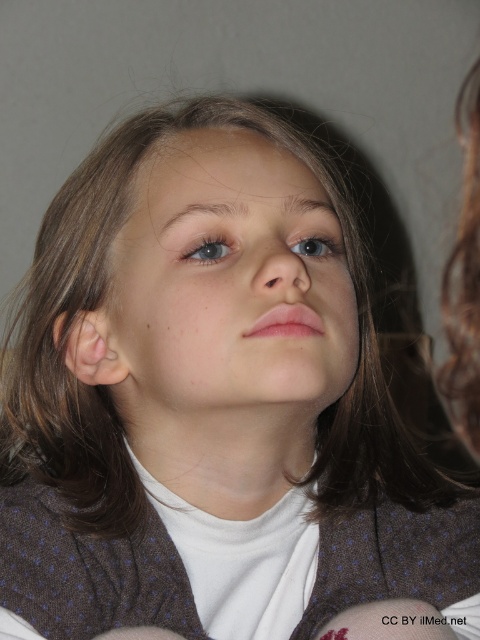
Does smooth skin face at center appear under blue glossy eye at upper center?

Yes.

Is smooth skin face at center further to camera compared to blue glossy eye at upper center?

No, it is not.

Locate an element on the screen. smooth skin face at center is located at coordinates (227, 285).

Is blue matte eye at center closer to camera compared to blue glossy eye at upper center?

Yes, it is in front of blue glossy eye at upper center.

This screenshot has width=480, height=640. Find the location of `blue matte eye at center`. blue matte eye at center is located at coordinates (208, 250).

Between point (115, 298) and point (216, 248), which one is positioned behind?

The point (115, 298) is more distant.

Does smooth skin face at center appear on the right side of blue matte eye at center?

Incorrect, smooth skin face at center is not on the right side of blue matte eye at center.

The height and width of the screenshot is (640, 480). What do you see at coordinates (227, 285) in the screenshot?
I see `smooth skin face at center` at bounding box center [227, 285].

This screenshot has height=640, width=480. What are the coordinates of `smooth skin face at center` in the screenshot? It's located at 227,285.